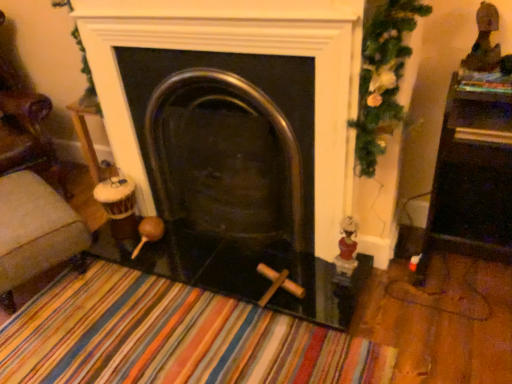
Locate an element on the screen. The image size is (512, 384). free location in front of white porcelain figurine at right, the second toy from the right is located at coordinates (334, 300).